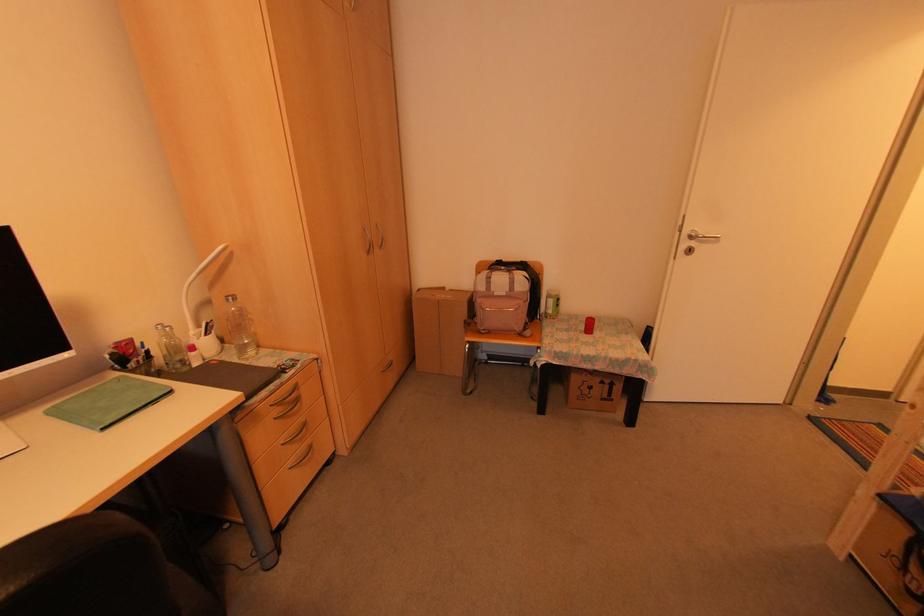
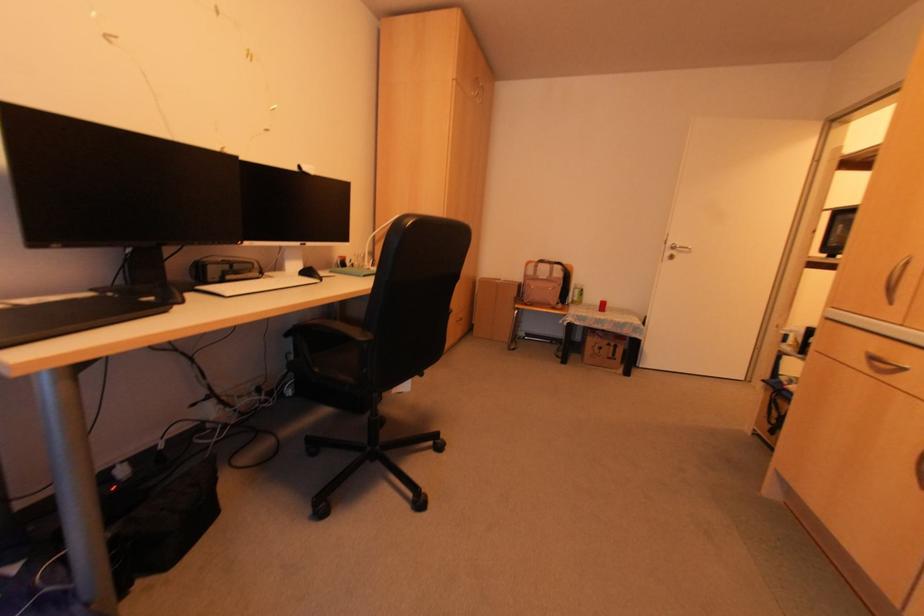
In the second image, find the point that corresponds to pixel 502 294 in the first image.

(542, 278)